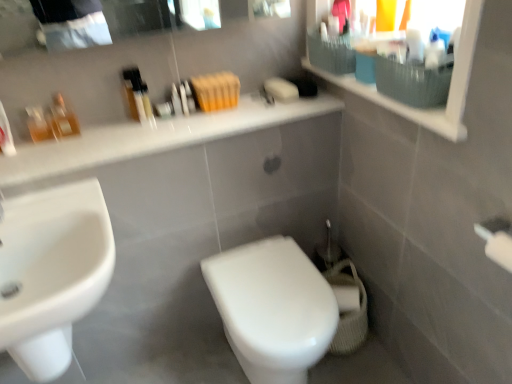
Describe the element at coordinates (152, 137) in the screenshot. This screenshot has width=512, height=384. I see `white glossy countertop at upper center` at that location.

You are a GUI agent. You are given a task and a screenshot of the screen. Output one action in this format:
    pyautogui.click(x=<x>, y=<y>)
    Task: Click on the white glossy sink at lower left
    
    Given the screenshot: What is the action you would take?
    pyautogui.click(x=52, y=272)

You are a GUI agent. You are given a task and a screenshot of the screen. Output one action in this format:
    pyautogui.click(x=<x>, y=<y>)
    Task: Click on the translucent plastic bottles at upper center, the 3th toiletry in the left-to-right sequence
    This screenshot has width=512, height=384.
    Given the screenshot: What is the action you would take?
    pyautogui.click(x=131, y=88)

Where is `white glossy toilet at center`? white glossy toilet at center is located at coordinates (272, 308).

In order to click on textured grey basket at upper right in this screenshot , I will do `click(331, 52)`.

Where is `white glossy countertop at upper center`? The image size is (512, 384). white glossy countertop at upper center is located at coordinates (152, 137).

Is translucent plastic bottles at upper center, positioned as the first toiletry in right-to-left order, looking in the opposite direction of white glossy faucet at left?

No, white glossy faucet at left is not at the back of translucent plastic bottles at upper center, positioned as the first toiletry in right-to-left order.

Looking at this image, could you measure the distance between translucent plastic bottles at upper center, positioned as the first toiletry in right-to-left order, and white glossy faucet at left?

A distance of 20.65 inches exists between translucent plastic bottles at upper center, positioned as the first toiletry in right-to-left order, and white glossy faucet at left.

Does point (131, 68) lie in front of point (2, 219)?

That is False.

In the scene shown: Does translucent plastic bottles at upper center, positioned as the first toiletry in right-to-left order, have a smaller size compared to white glossy faucet at left?

Yes.

Which object is further away from the camera taking this photo, white glossy countertop at upper center or white glossy faucet at left?

Positioned behind is white glossy countertop at upper center.

From a real-world perspective, is white glossy countertop at upper center physically located above or below white glossy faucet at left?

white glossy countertop at upper center is situated lower than white glossy faucet at left in the real world.

Which of these two, white glossy countertop at upper center or white glossy faucet at left, is bigger?

white glossy countertop at upper center.

Can you confirm if white glossy countertop at upper center is taller than white glossy faucet at left?

In fact, white glossy countertop at upper center may be shorter than white glossy faucet at left.

From the image's perspective, is white glossy countertop at upper center above or below translucent glass bottles at left, the 3th toiletry from the right?

Based on their image positions, white glossy countertop at upper center is located beneath translucent glass bottles at left, the 3th toiletry from the right.

Which object is thinner, white glossy countertop at upper center or translucent glass bottles at left, the 3th toiletry from the right?

Thinner between the two is translucent glass bottles at left, the 3th toiletry from the right.

The height and width of the screenshot is (384, 512). I want to click on counter top located in front of the translucent glass bottles at left, which is counted as the first toiletry, starting from the left, so click(x=152, y=137).

Is white glossy sink at lower left touching translucent plastic bottles at upper center, the 3th toiletry in the left-to-right sequence?

There is a gap between white glossy sink at lower left and translucent plastic bottles at upper center, the 3th toiletry in the left-to-right sequence.

Which object is wider, white glossy sink at lower left or translucent plastic bottles at upper center, positioned as the first toiletry in right-to-left order?

With larger width is white glossy sink at lower left.

Considering the relative positions of white glossy sink at lower left and translucent plastic bottles at upper center, the 3th toiletry in the left-to-right sequence, in the image provided, is white glossy sink at lower left to the left of translucent plastic bottles at upper center, the 3th toiletry in the left-to-right sequence, from the viewer's perspective?

Yes.

How different are the orientations of white glossy countertop at upper center and translucent glass perfume bottles at upper left, arranged as the 2th toiletry when viewed from the right, in degrees?

The facing directions of white glossy countertop at upper center and translucent glass perfume bottles at upper left, arranged as the 2th toiletry when viewed from the right, are 1.05 degrees apart.

Considering the positions of objects white glossy countertop at upper center and translucent glass perfume bottles at upper left, arranged as the 2th toiletry when viewed from the left, in the image provided, who is in front, white glossy countertop at upper center or translucent glass perfume bottles at upper left, arranged as the 2th toiletry when viewed from the left,?

white glossy countertop at upper center is closer to the camera.

Who is smaller, white glossy countertop at upper center or translucent glass perfume bottles at upper left, arranged as the 2th toiletry when viewed from the right?

Smaller between the two is translucent glass perfume bottles at upper left, arranged as the 2th toiletry when viewed from the right.

Which is less distant, [219,128] or [68,125]?

Point [219,128] appears to be closer to the viewer than point [68,125].

Consider the image. Is white glossy countertop at upper center looking in the opposite direction of white glossy sink at lower left?

No, white glossy countertop at upper center's orientation is not away from white glossy sink at lower left.

Based on the photo, is there a large distance between white glossy countertop at upper center and white glossy sink at lower left?

That's not correct — white glossy countertop at upper center is a little close to white glossy sink at lower left.

Between white glossy countertop at upper center and white glossy sink at lower left, which one has smaller size?

white glossy countertop at upper center is smaller.

Who is taller, white glossy countertop at upper center or white glossy sink at lower left?

white glossy sink at lower left is taller.

Can you confirm if white glossy faucet at left is shorter than white glossy countertop at upper center?

In fact, white glossy faucet at left may be taller than white glossy countertop at upper center.

Is point (2, 243) more distant than point (8, 161)?

No, (2, 243) is in front of (8, 161).

Locate an element on the screen. The height and width of the screenshot is (384, 512). counter top below the white glossy faucet at left (from a real-world perspective) is located at coordinates (152, 137).

Choose the correct answer: Is white glossy faucet at left inside white glossy countertop at upper center or outside it?

white glossy faucet at left exists outside the volume of white glossy countertop at upper center.

Where is `faucet on the left of translucent plastic bottles at upper center, the 3th toiletry in the left-to-right sequence`? Image resolution: width=512 pixels, height=384 pixels. faucet on the left of translucent plastic bottles at upper center, the 3th toiletry in the left-to-right sequence is located at coordinates (1, 206).

At what (x,y) coordinates should I click in order to perform the action: click on faucet that is above the white glossy countertop at upper center (from a real-world perspective). Please return your answer as a coordinate pair (x, y). The width and height of the screenshot is (512, 384). Looking at the image, I should click on (1, 206).

Which object lies further to the anchor point translucent plastic bottles at upper center, positioned as the first toiletry in right-to-left order, translucent glass bottles at left, which is counted as the first toiletry, starting from the left, or white glossy sink at lower left?

Among the two, white glossy sink at lower left is located further to translucent plastic bottles at upper center, positioned as the first toiletry in right-to-left order.

Which object lies further to the anchor point translucent plastic bottles at upper center, positioned as the first toiletry in right-to-left order, translucent glass perfume bottles at upper left, arranged as the 2th toiletry when viewed from the left, or translucent glass bottles at left, which is counted as the first toiletry, starting from the left?

The object further to translucent plastic bottles at upper center, positioned as the first toiletry in right-to-left order, is translucent glass bottles at left, which is counted as the first toiletry, starting from the left.

From the image, which object appears to be farther from translucent glass bottles at left, the 3th toiletry from the right, white glossy countertop at upper center or white glossy faucet at left?

white glossy countertop at upper center is further to translucent glass bottles at left, the 3th toiletry from the right.

Estimate the real-world distances between objects in this image. Which object is closer to white glossy countertop at upper center, white glossy toilet at center or white glossy faucet at left?

white glossy faucet at left lies closer to white glossy countertop at upper center than the other object.

Based on their spatial positions, is translucent glass perfume bottles at upper left, arranged as the 2th toiletry when viewed from the left, or matte white medicine cabinet at upper right closer to white glossy sink at lower left?

translucent glass perfume bottles at upper left, arranged as the 2th toiletry when viewed from the left.

Which object lies further to the anchor point translucent glass perfume bottles at upper left, arranged as the 2th toiletry when viewed from the left, matte white medicine cabinet at upper right or white glossy faucet at left?

Based on the image, matte white medicine cabinet at upper right appears to be further to translucent glass perfume bottles at upper left, arranged as the 2th toiletry when viewed from the left.

In the scene shown: Looking at the image, which one is located closer to translucent glass perfume bottles at upper left, arranged as the 2th toiletry when viewed from the right, textured grey basket at upper right or white glossy sink at lower left?

white glossy sink at lower left lies closer to translucent glass perfume bottles at upper left, arranged as the 2th toiletry when viewed from the right, than the other object.

From the image, which object appears to be nearer to matte white medicine cabinet at upper right, translucent plastic bottles at upper center, positioned as the first toiletry in right-to-left order, or textured grey basket at upper right?

textured grey basket at upper right is positioned closer to the anchor matte white medicine cabinet at upper right.

Where is `toiletry between white glossy sink at lower left and matte white medicine cabinet at upper right`? The width and height of the screenshot is (512, 384). toiletry between white glossy sink at lower left and matte white medicine cabinet at upper right is located at coordinates (131, 88).

Locate an element on the screen. Image resolution: width=512 pixels, height=384 pixels. basket situated between translucent glass perfume bottles at upper left, arranged as the 2th toiletry when viewed from the right, and matte white medicine cabinet at upper right from left to right is located at coordinates pyautogui.click(x=331, y=52).

Image resolution: width=512 pixels, height=384 pixels. In order to click on toiletry between translucent glass perfume bottles at upper left, arranged as the 2th toiletry when viewed from the right, and white glossy sink at lower left in the up-down direction in this screenshot , I will do `click(38, 124)`.

Where is `counter top between translucent glass perfume bottles at upper left, arranged as the 2th toiletry when viewed from the right, and textured grey basket at upper right, in the horizontal direction`? counter top between translucent glass perfume bottles at upper left, arranged as the 2th toiletry when viewed from the right, and textured grey basket at upper right, in the horizontal direction is located at coordinates (152, 137).